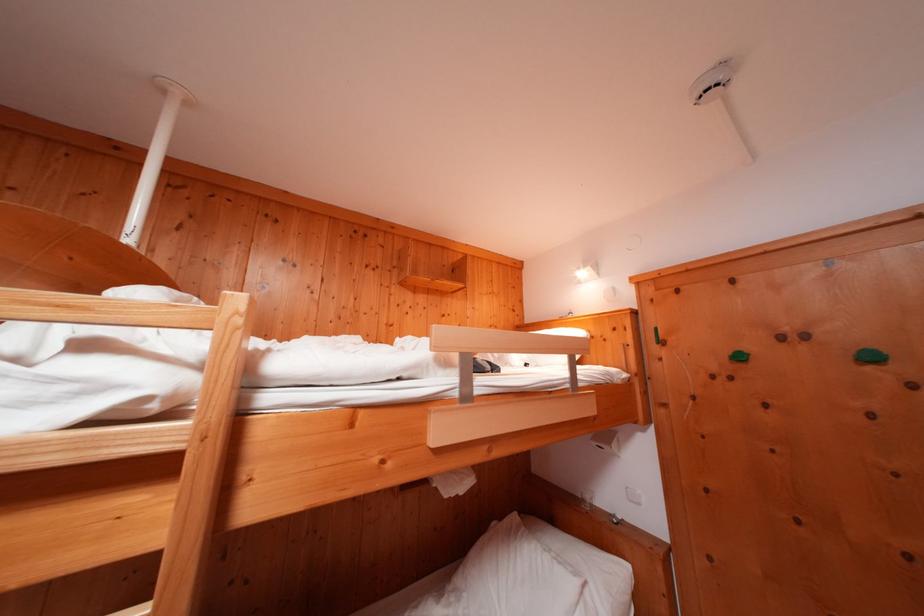
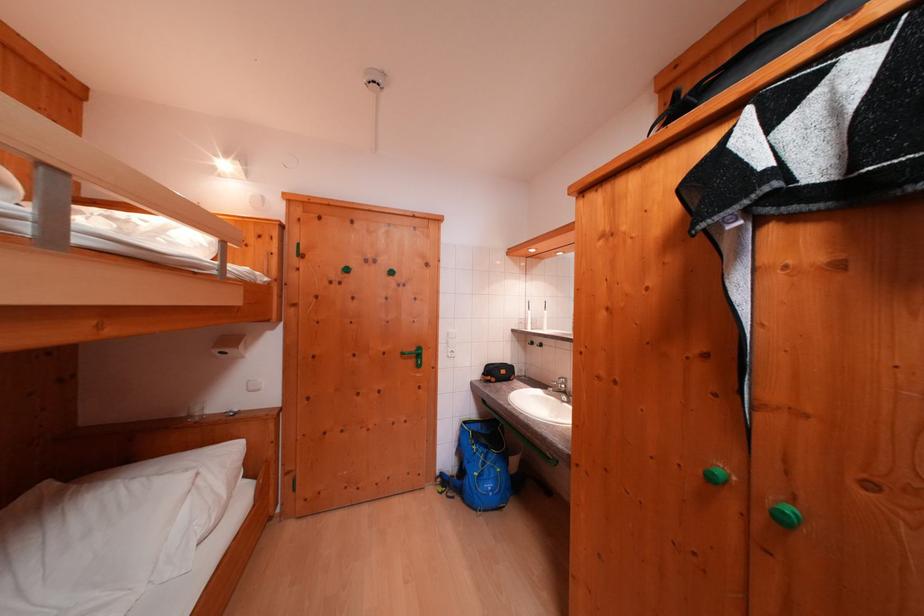
Question: Based on the continuous images, in which direction is the camera rotating? Reply with the corresponding letter.

Choices:
 (A) Left
 (B) Right
 (C) Up
 (D) Down

Answer: (B)